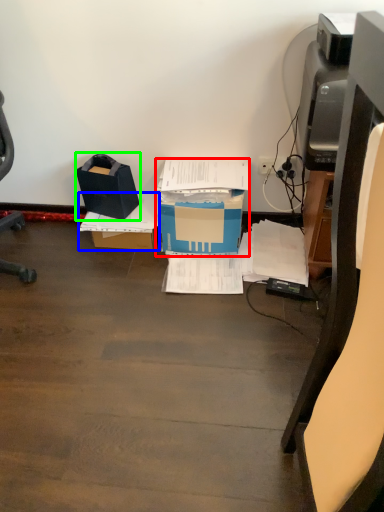
Question: Based on their relative distances, which object is farther from box (highlighted by a red box)? Choose from cardboard box (highlighted by a blue box) and box (highlighted by a green box).

Choices:
 (A) cardboard box
 (B) box

Answer: (B)